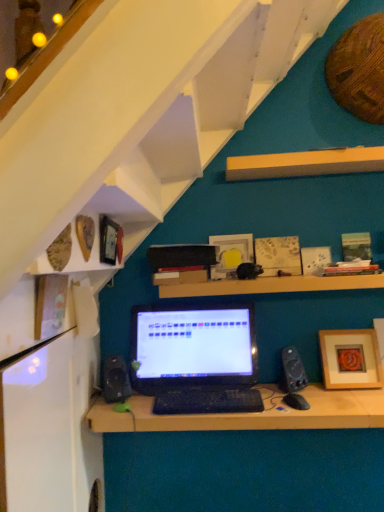
At what (x,y) coordinates should I click in order to perform the action: click on vacant space underneath black plastic keyboard at center (from a real-world perspective). Please return your answer as a coordinate pair (x, y). This screenshot has width=384, height=512. Looking at the image, I should click on (195, 414).